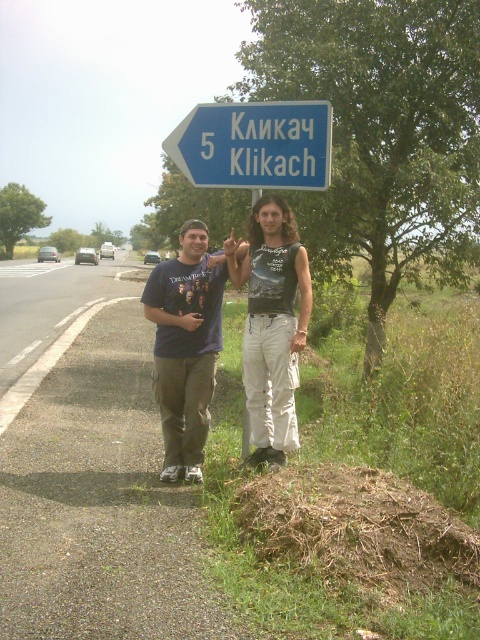
Can you confirm if matte blue t-shirt at center is bigger than blue plastic sign at upper center?

Yes.

Between point (159, 394) and point (171, 141), which one is positioned behind?

Positioned behind is point (171, 141).

Locate an element on the screen. matte blue t-shirt at center is located at coordinates (186, 346).

Is dark gray sleeveless shirt at center thinner than blue plastic sign at upper center?

Indeed, dark gray sleeveless shirt at center has a lesser width compared to blue plastic sign at upper center.

How distant is dark gray sleeveless shirt at center from blue plastic sign at upper center?

They are 3.95 feet apart.

Who is more forward, (280, 234) or (215, 186)?

Point (280, 234) is more forward.

Find the location of a particular element. This screenshot has height=640, width=480. dark gray sleeveless shirt at center is located at coordinates (272, 323).

Does matte blue t-shirt at center have a lesser height compared to dark gray sleeveless shirt at center?

In fact, matte blue t-shirt at center may be taller than dark gray sleeveless shirt at center.

Can you confirm if matte blue t-shirt at center is positioned above dark gray sleeveless shirt at center?

Incorrect, matte blue t-shirt at center is not positioned above dark gray sleeveless shirt at center.

Is point (188, 320) less distant than point (268, 272)?

No, (188, 320) is behind (268, 272).

Image resolution: width=480 pixels, height=640 pixels. Identify the location of matte blue t-shirt at center. (186, 346).